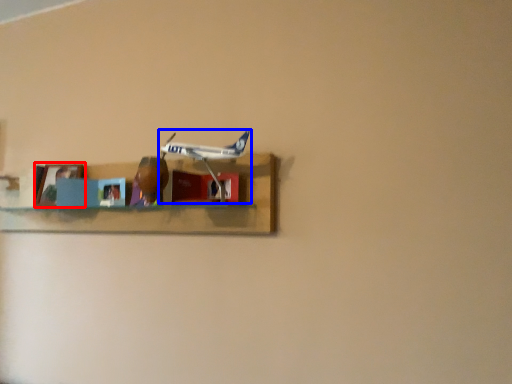
Question: Among these objects, which one is farthest to the camera, picture frame (highlighted by a red box) or airplane (highlighted by a blue box)?

Choices:
 (A) picture frame
 (B) airplane

Answer: (A)